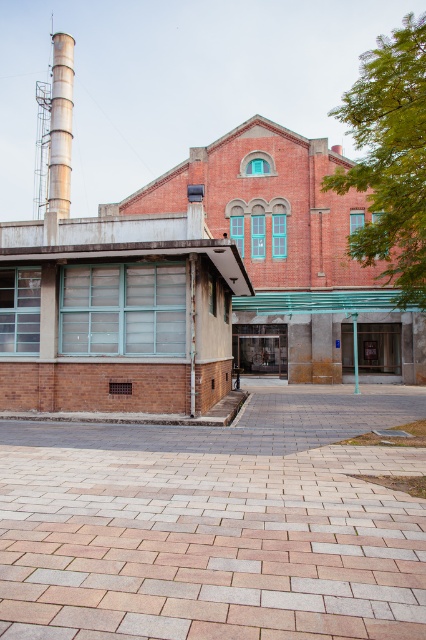
Based on the photo, you are standing 10 feet away from the brick building. You want to walk to the pebble stone pavement at center. Can you reach it without moving past the building?

The pebble stone pavement at center is 10.25 feet away from the viewer. Since you are already standing 10 feet away from the building, you would need to move an additional 0.25 feet forward to reach the pavement, which is possible without moving past the building.

You are standing in front of the red brick building at center and want to take a photo of the brushed metal pipe at upper left. Since the building is in the way, where should you move to get a clear view?

Since the red brick building at center is closer to the viewer than the brushed metal pipe at upper left, you should move to the right side of the red brick building at center to get a clear view of the brushed metal pipe at upper left.

You are standing at the point marked by the coordinates point (291, 257). Based on the scene description, what structure are you currently positioned at?

The point (291, 257) marks the red brick building at center, so you are positioned at the red brick building at center.